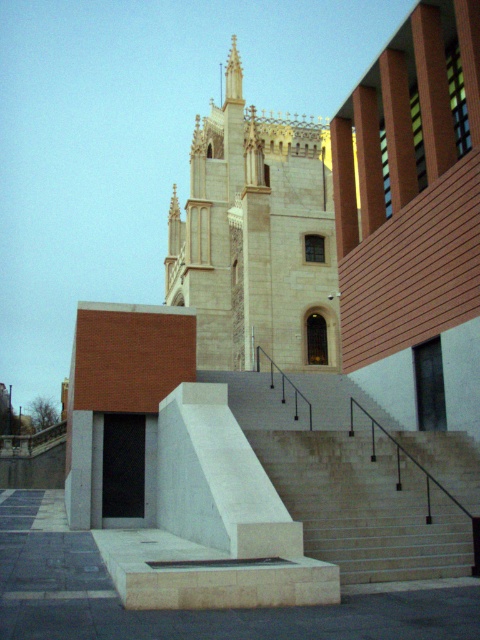
Question: Which of the following is the closest to the observer?

Choices:
 (A) (336, 368)
 (B) (288, 484)

Answer: (B)

Question: Is light beige stone tower at center positioned behind white marble stairs at center?

Choices:
 (A) yes
 (B) no

Answer: (A)

Question: Which object is closer to the camera taking this photo?

Choices:
 (A) light beige stone tower at center
 (B) white marble stairs at center

Answer: (B)

Question: Does light beige stone tower at center have a smaller size compared to white marble stairs at center?

Choices:
 (A) no
 (B) yes

Answer: (A)

Question: Among these objects, which one is nearest to the camera?

Choices:
 (A) light beige stone tower at center
 (B) white marble stairs at center

Answer: (B)

Question: Does light beige stone tower at center have a greater width compared to white marble stairs at center?

Choices:
 (A) no
 (B) yes

Answer: (B)